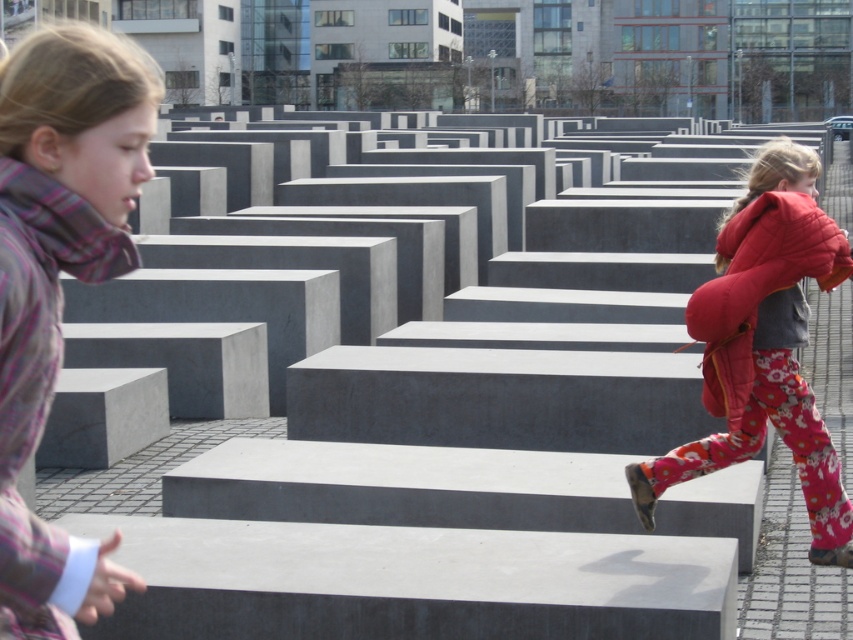
Based on the photo, you are standing at the center of the Holocaust Memorial in Berlin. You notice a point marked at coordinates (764, 346). Based on the scene description, what object or feature is located at that point?

The point at coordinates (764, 346) indicates the location of the floral pants at right.